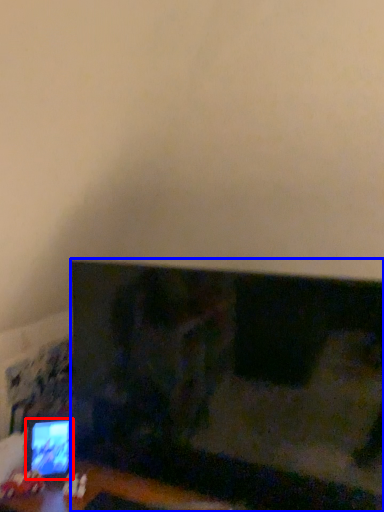
Question: Which of the following is the farthest to the observer, computer monitor (highlighted by a red box) or television (highlighted by a blue box)?

Choices:
 (A) computer monitor
 (B) television

Answer: (A)